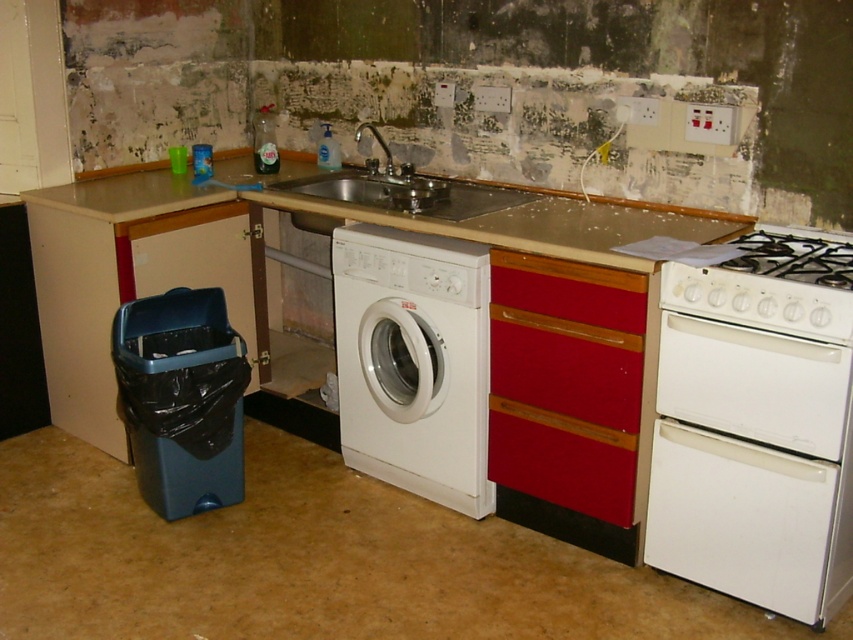
Which is in front, point (612, 284) or point (355, 134)?

Point (612, 284) is more forward.

This screenshot has width=853, height=640. In order to click on red wood drawer at center in this screenshot , I will do `click(569, 291)`.

Based on the photo, does white glossy oven at lower right appear on the left side of white glossy gas stove at upper right?

Yes, white glossy oven at lower right is to the left of white glossy gas stove at upper right.

Is white glossy oven at lower right positioned at the back of white glossy gas stove at upper right?

Yes.

Between point (693, 480) and point (720, 272), which one is positioned in front?

Point (720, 272) is in front.

This screenshot has width=853, height=640. Identify the location of white glossy oven at lower right. (756, 428).

Is white matte washing machine at center positioned at the back of brushed metal faucet at upper center?

No, it is in front of brushed metal faucet at upper center.

Who is positioned more to the left, white matte washing machine at center or brushed metal faucet at upper center?

brushed metal faucet at upper center

Describe the element at coordinates (413, 362) in the screenshot. This screenshot has height=640, width=853. I see `white matte washing machine at center` at that location.

You are a GUI agent. You are given a task and a screenshot of the screen. Output one action in this format:
    pyautogui.click(x=<x>, y=<y>)
    Task: Click on the white matte washing machine at center
    The width and height of the screenshot is (853, 640).
    Given the screenshot: What is the action you would take?
    pyautogui.click(x=413, y=362)